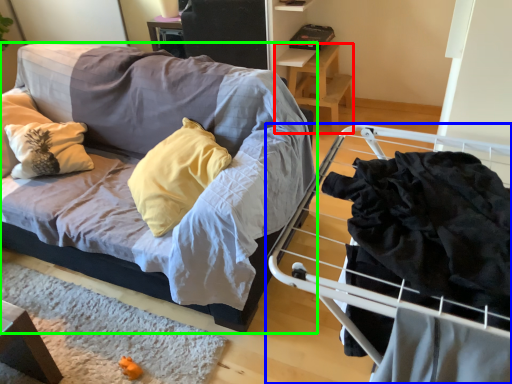
Question: Which object is positioned closest to table (highlighted by a red box)? Select from furniture (highlighted by a blue box) and studio couch (highlighted by a green box).

Choices:
 (A) furniture
 (B) studio couch

Answer: (B)